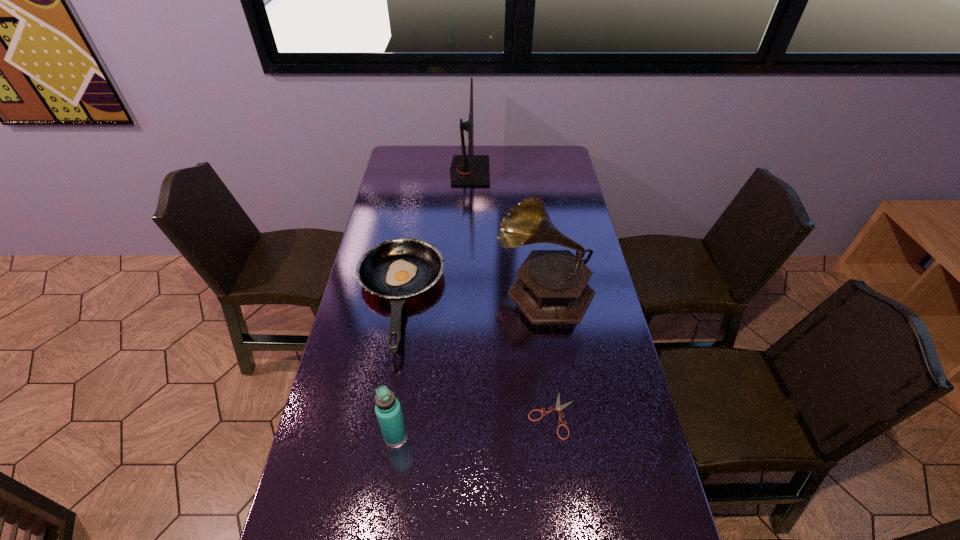
Locate an element on the screen. free space located on the front of the frying pan is located at coordinates (368, 472).

Where is `vacant region located 0.120m on the front of the shears`? The height and width of the screenshot is (540, 960). vacant region located 0.120m on the front of the shears is located at coordinates (562, 490).

Find the location of `object present at the far edge`. object present at the far edge is located at coordinates (470, 169).

This screenshot has width=960, height=540. What are the coordinates of `object that is at the left edge` in the screenshot? It's located at (399, 268).

You are a GUI agent. You are given a task and a screenshot of the screen. Output one action in this format:
    pyautogui.click(x=<x>, y=<y>)
    Task: Click on the phonograph record present at the right edge
    Image resolution: width=960 pixels, height=540 pixels.
    Given the screenshot: What is the action you would take?
    pyautogui.click(x=551, y=286)

I want to click on shears that is at the right edge, so click(558, 408).

The height and width of the screenshot is (540, 960). In order to click on vacant region at the left edge in this screenshot , I will do `click(410, 210)`.

Locate an element on the screen. free location at the right edge of the desktop is located at coordinates (616, 415).

Where is `free spot between the second shortest object and the shortest object`? This screenshot has width=960, height=540. free spot between the second shortest object and the shortest object is located at coordinates (475, 357).

This screenshot has width=960, height=540. In order to click on empty space between the phonograph record and the shears in this screenshot , I will do `click(548, 352)`.